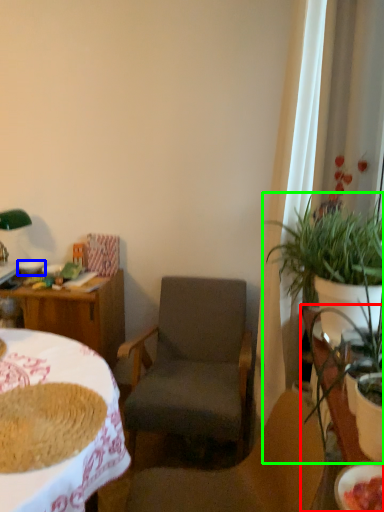
Question: Estimate the real-world distances between objects in this image. Which object is farther from table (highlighted by a red box), bowl (highlighted by a blue box) or houseplant (highlighted by a green box)?

Choices:
 (A) bowl
 (B) houseplant

Answer: (A)